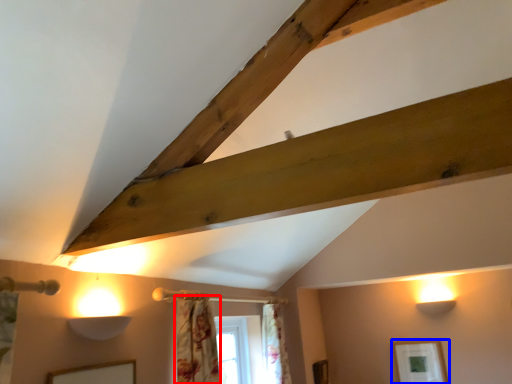
Question: Which object is closer to the camera taking this photo, curtain (highlighted by a red box) or picture frame (highlighted by a blue box)?

Choices:
 (A) curtain
 (B) picture frame

Answer: (A)